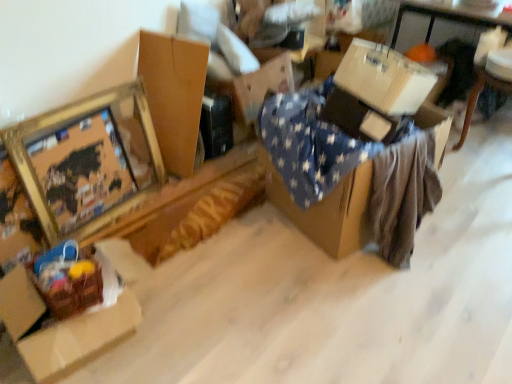
The image size is (512, 384). Identify the location of vacant space that's between brown cardboard box at lower left, which is the 3th cardboard box in right-to-left order, and blue star-patterned fabric at center, arranged as the first table when viewed from the front. (246, 277).